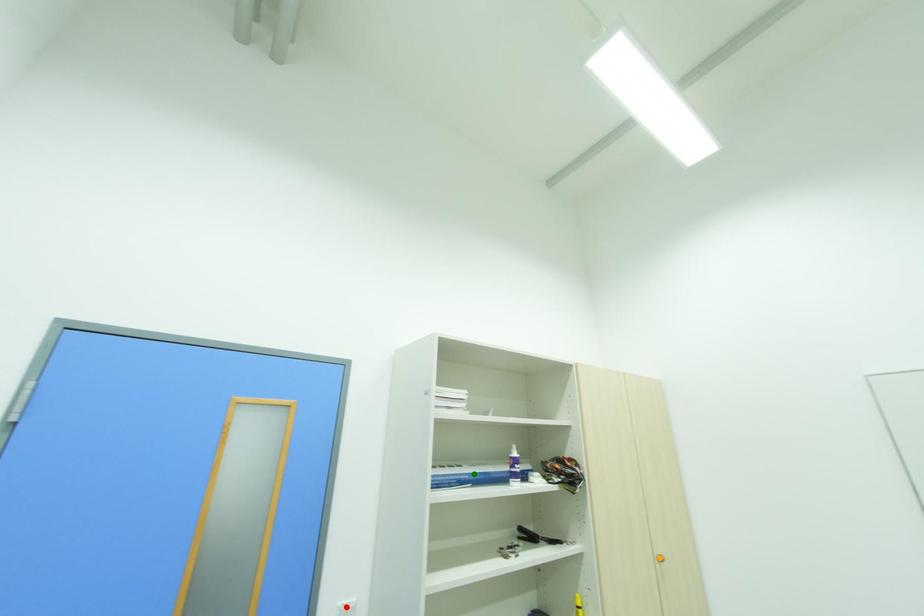
Order these from nearest to farthest:
orange point | red point | green point

red point, green point, orange point